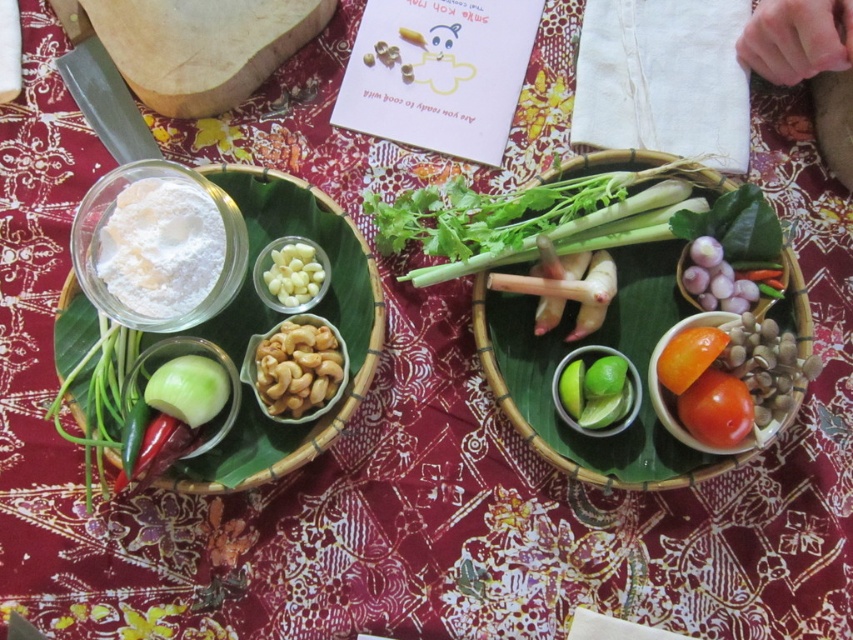
Is point (299, 410) more distant than point (701, 260)?

No, it is in front of (701, 260).

Does point (262, 404) come closer to viewer compared to point (741, 280)?

Yes, point (262, 404) is closer to viewer.

Who is more forward, (310,413) or (708,308)?

Point (310,413) is more forward.

Image resolution: width=853 pixels, height=640 pixels. Find the location of `light brown smooth cashew nuts at center`. light brown smooth cashew nuts at center is located at coordinates (299, 369).

Image resolution: width=853 pixels, height=640 pixels. What do you see at coordinates (735, 225) in the screenshot?
I see `green leafy vegetable at upper right` at bounding box center [735, 225].

Who is positioned more to the left, green leafy vegetable at upper right or green smooth onion at lower left?

green smooth onion at lower left is more to the left.

Between point (701, 228) and point (201, 422), which one is positioned in front?

Point (201, 422) is in front.

Find the location of a particular element. The image size is (853, 640). green leafy vegetable at upper right is located at coordinates (735, 225).

Can you confirm if red glossy tomato at right is positioned below orange smooth tomato at center?

Yes, red glossy tomato at right is below orange smooth tomato at center.

Is red glossy tomato at right further to the viewer compared to orange smooth tomato at center?

That is False.

Image resolution: width=853 pixels, height=640 pixels. What are the coordinates of `red glossy tomato at right` in the screenshot? It's located at (717, 410).